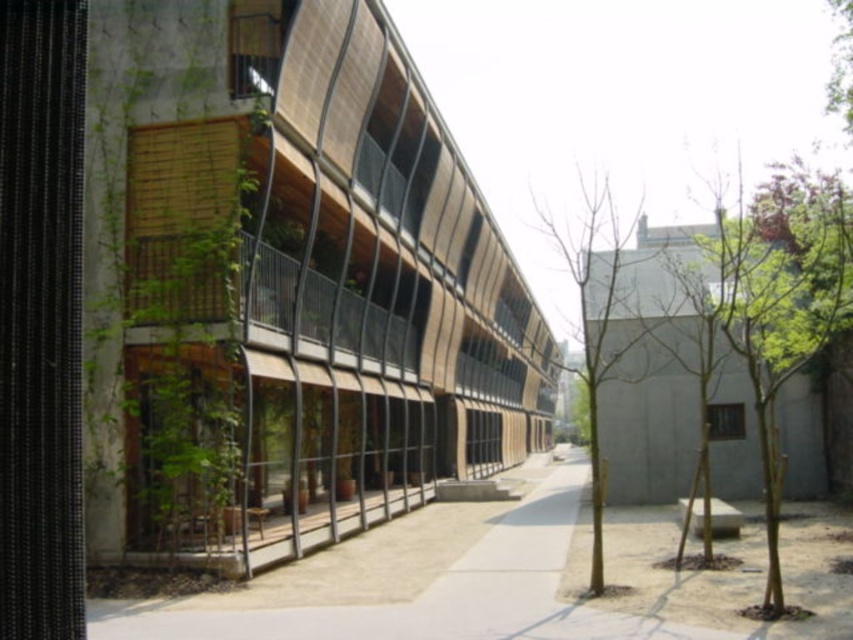
Question: Does smooth concrete pavement at center have a greater width compared to green leafy tree at center?

Choices:
 (A) no
 (B) yes

Answer: (A)

Question: Estimate the real-world distances between objects in this image. Which object is closer to the green leafy tree at center?

Choices:
 (A) green leafy tree at center right
 (B) smooth concrete pavement at center

Answer: (A)

Question: Does smooth concrete pavement at center have a greater width compared to green leafy tree at center right?

Choices:
 (A) no
 (B) yes

Answer: (A)

Question: Can you confirm if green leafy tree at center right is bigger than green leafy tree at center?

Choices:
 (A) no
 (B) yes

Answer: (B)

Question: Which point is closer to the camera taking this photo?

Choices:
 (A) (621, 509)
 (B) (582, 324)
 (C) (840, 266)

Answer: (C)

Question: Among these objects, which one is nearest to the camera?

Choices:
 (A) green leafy tree at center
 (B) smooth concrete pavement at center

Answer: (B)